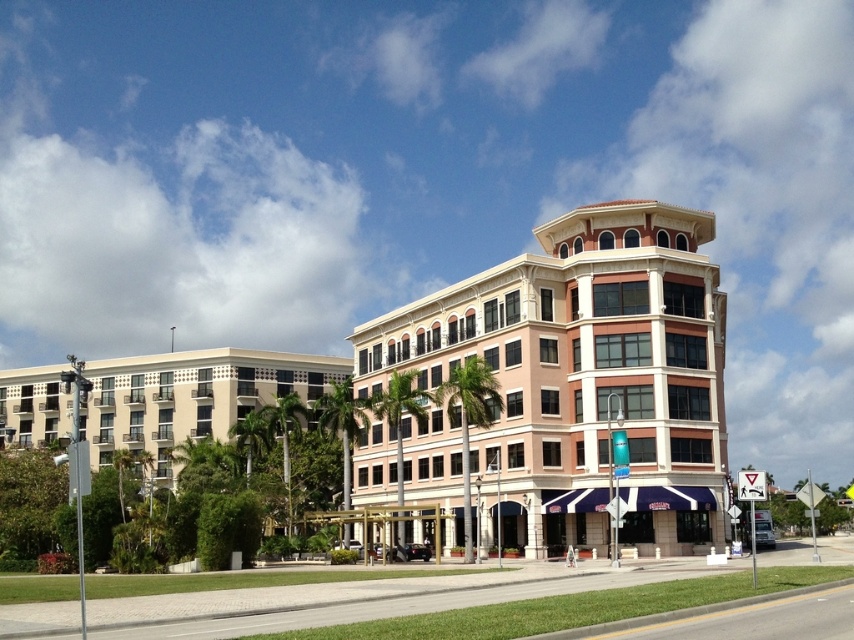
You are standing at the center of the image and want to locate the beige stone building at center. According to the coordinates provided, in which direction should you look to find it?

The beige stone building at center is located at coordinates point (576,378), so you should look slightly to the right and downward from the very center of the image to find it.

You are a city planner assessing the skyline of this area. Based on the image, which of the two buildings, the beige stone building at center or the beige concrete building at left, contributes more to the verticality of the skyline?

The beige stone building at center contributes more to the verticality of the skyline because it has a greater height compared to the beige concrete building at left.